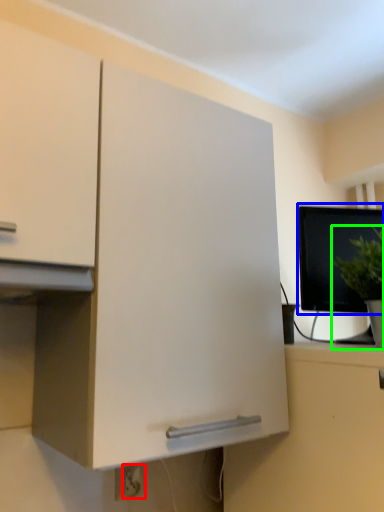
Question: Based on their relative distances, which object is nearer to electric outlet (highlighted by a red box)? Choose from computer monitor (highlighted by a blue box) and houseplant (highlighted by a green box).

Choices:
 (A) computer monitor
 (B) houseplant

Answer: (B)